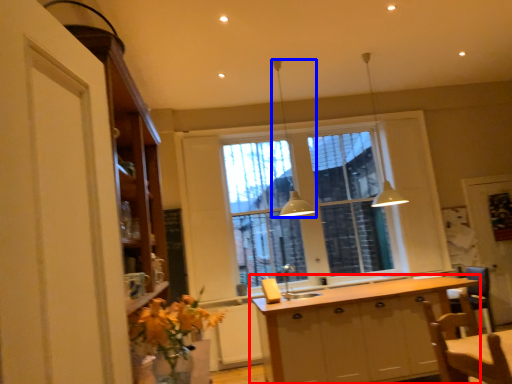
Question: Which of the following is the farthest to the observer, cabinetry (highlighted by a red box) or light fixture (highlighted by a blue box)?

Choices:
 (A) cabinetry
 (B) light fixture

Answer: (B)